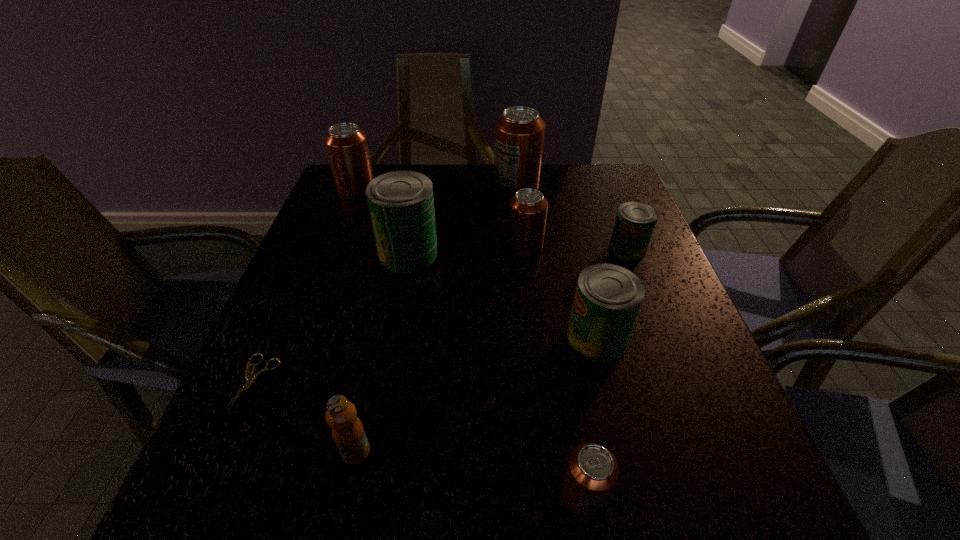
The image size is (960, 540). Find the location of `orange can object that ranks as the third closest to the nearest can`. orange can object that ranks as the third closest to the nearest can is located at coordinates (346, 144).

Where is `green can that can be found as the third closest to the orange juice`? Image resolution: width=960 pixels, height=540 pixels. green can that can be found as the third closest to the orange juice is located at coordinates (635, 221).

Point out which green can is positioned as the nearest to the rightmost object. Please provide its 2D coordinates. Your answer should be formatted as a tuple, i.e. [(x, y)], where the tuple contains the x and y coordinates of a point satisfying the conditions above.

[(608, 297)]

Locate an element on the screen. The height and width of the screenshot is (540, 960). vacant space that satisfies the following two spatial constraints: 1. on the front side of the tallest can; 2. on the right side of the nearest can is located at coordinates coord(551,495).

Identify the location of free location that satisfies the following two spatial constraints: 1. on the front label of the orange juice; 2. on the left side of the smallest orange can. Image resolution: width=960 pixels, height=540 pixels. (347, 495).